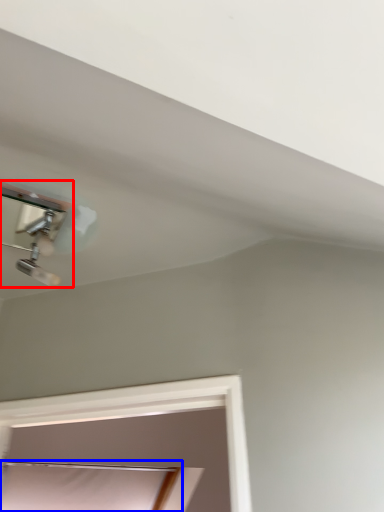
Question: Which object is further to the camera taking this photo, lamp (highlighted by a red box) or window (highlighted by a blue box)?

Choices:
 (A) lamp
 (B) window

Answer: (B)